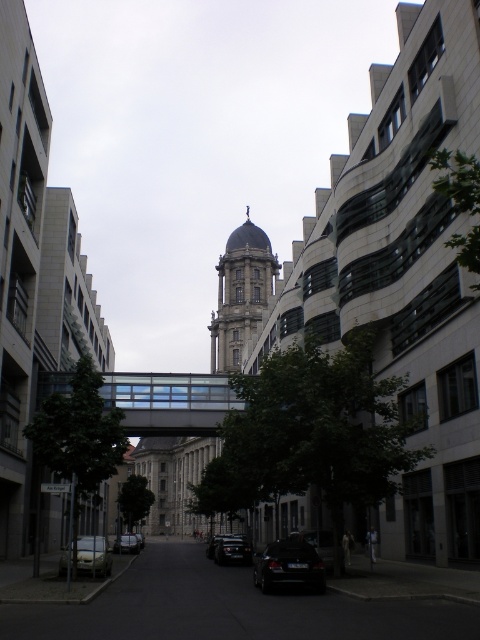
Question: Which object is farther from the camera taking this photo?

Choices:
 (A) black matte car at lower center
 (B) silver metallic car at lower left

Answer: (B)

Question: Which object appears farthest from the camera in this image?

Choices:
 (A) silver metallic car at lower left
 (B) transparent glass bridge at center
 (C) shiny black sedan at center
 (D) smooth gray stone bell tower at center

Answer: (D)

Question: Is smooth gray stone bell tower at center smaller than black matte car at lower center?

Choices:
 (A) no
 (B) yes

Answer: (A)

Question: In this image, where is transparent glass bridge at center located relative to black matte car at lower center?

Choices:
 (A) left
 (B) right

Answer: (A)

Question: Does transparent glass bridge at center lie behind smooth gray stone bell tower at center?

Choices:
 (A) no
 (B) yes

Answer: (A)

Question: Which point is closer to the camera?

Choices:
 (A) (205, 412)
 (B) (122, 538)
 (C) (83, 552)

Answer: (C)